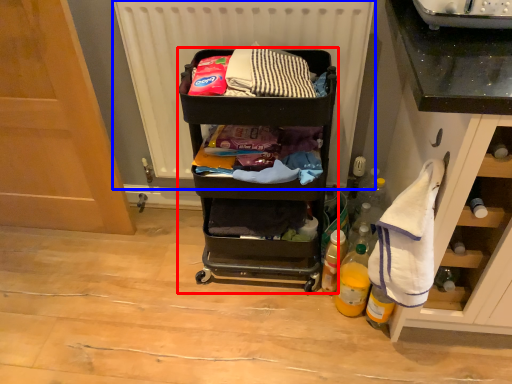
Question: Which object appears closest to the camera in this image, furniture (highlighted by a red box) or radiator (highlighted by a blue box)?

Choices:
 (A) furniture
 (B) radiator

Answer: (A)